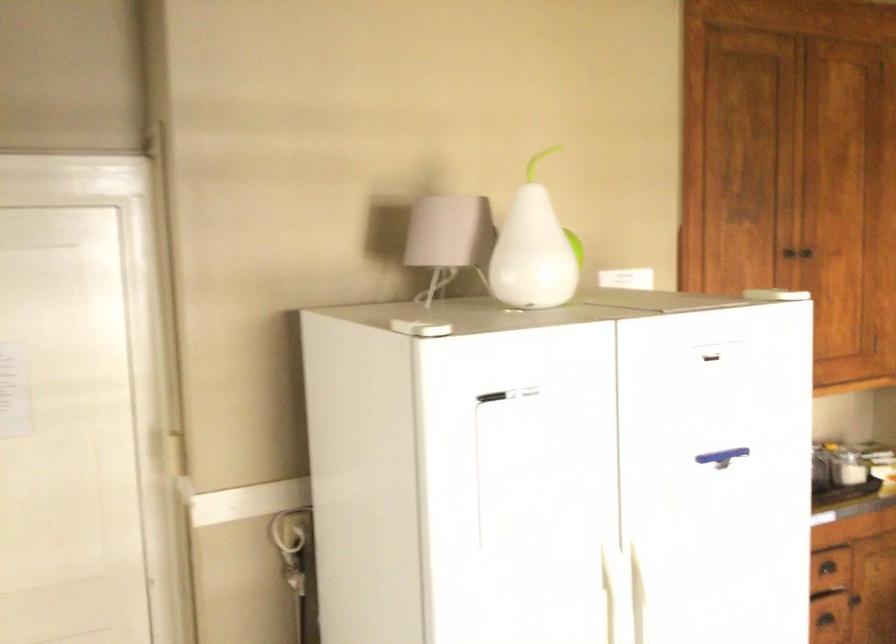
Where is `blue refrigerator handle`? blue refrigerator handle is located at coordinates (721, 457).